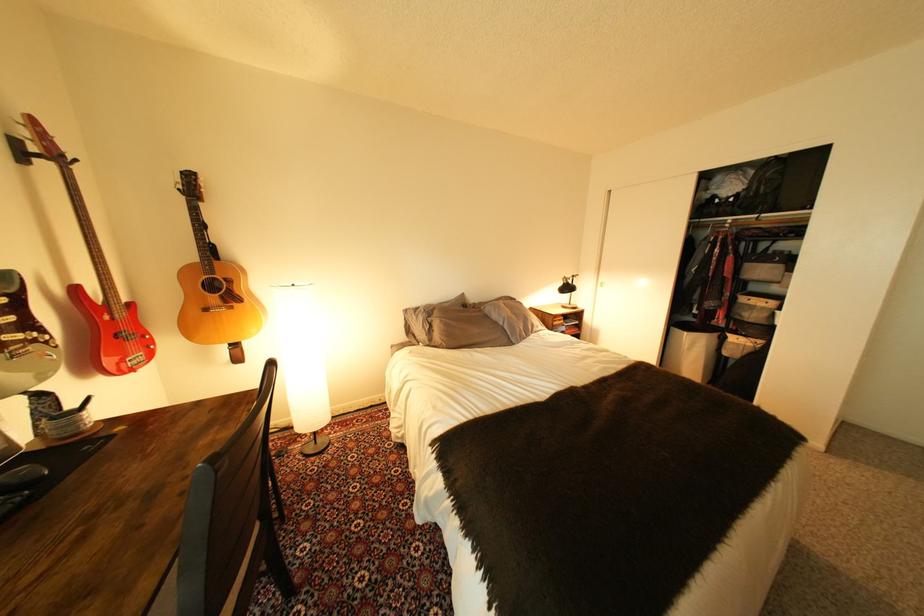
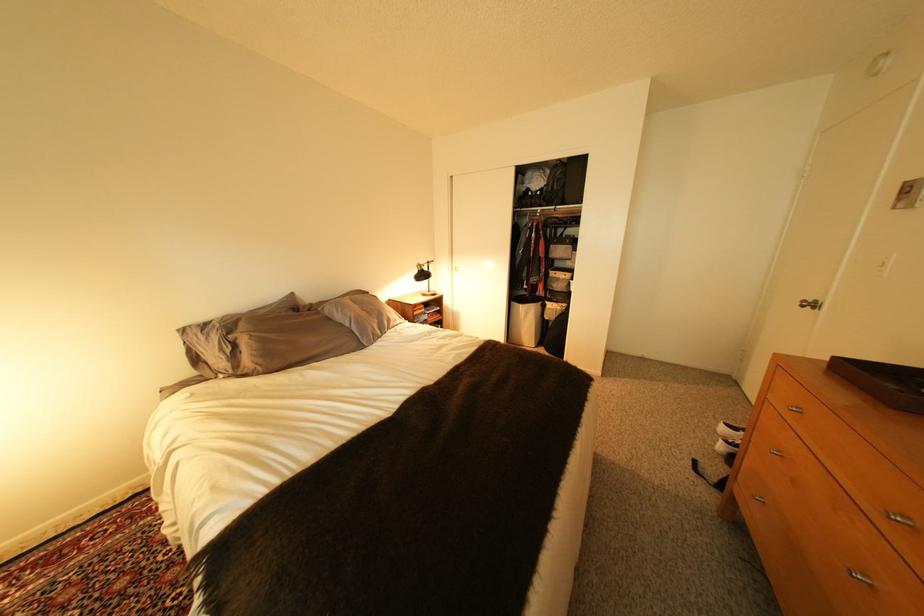
Locate, in the second image, the point that corresponds to [497,309] in the first image.

(335, 310)